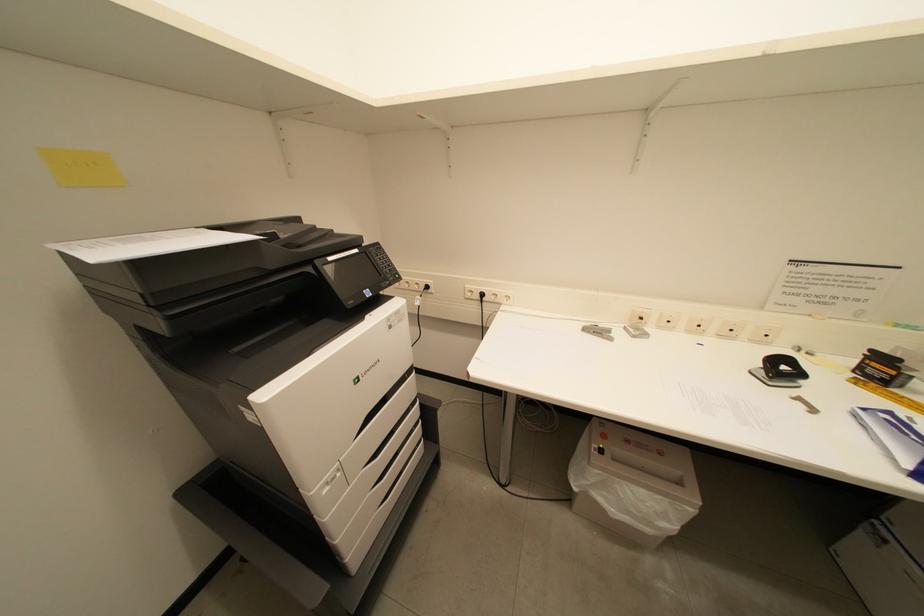
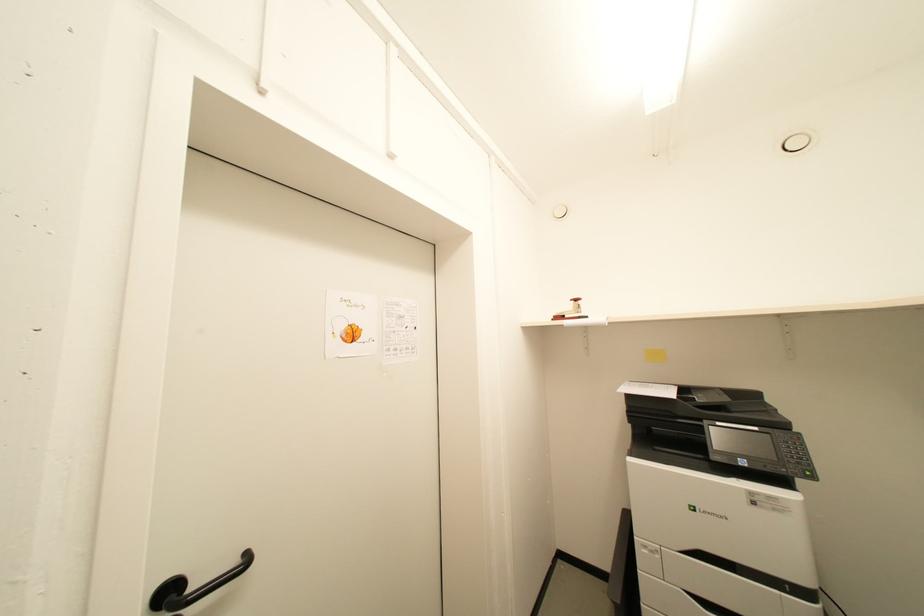
Question: The images are taken continuously from a first-person perspective. In which direction is your viewpoint rotating?

Choices:
 (A) Left
 (B) Right
 (C) Up
 (D) Down

Answer: (A)